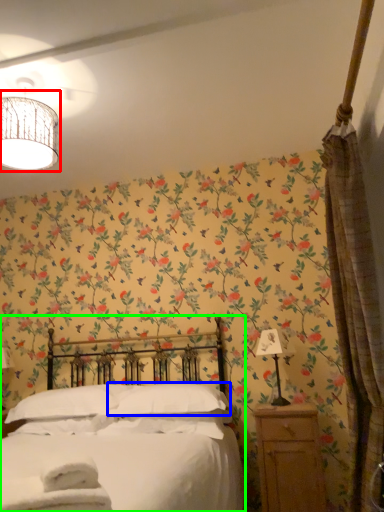
Question: Considering the real-world distances, which object is farthest from lamp (highlighted by a red box)? pillow (highlighted by a blue box) or bed (highlighted by a green box)?

Choices:
 (A) pillow
 (B) bed

Answer: (A)